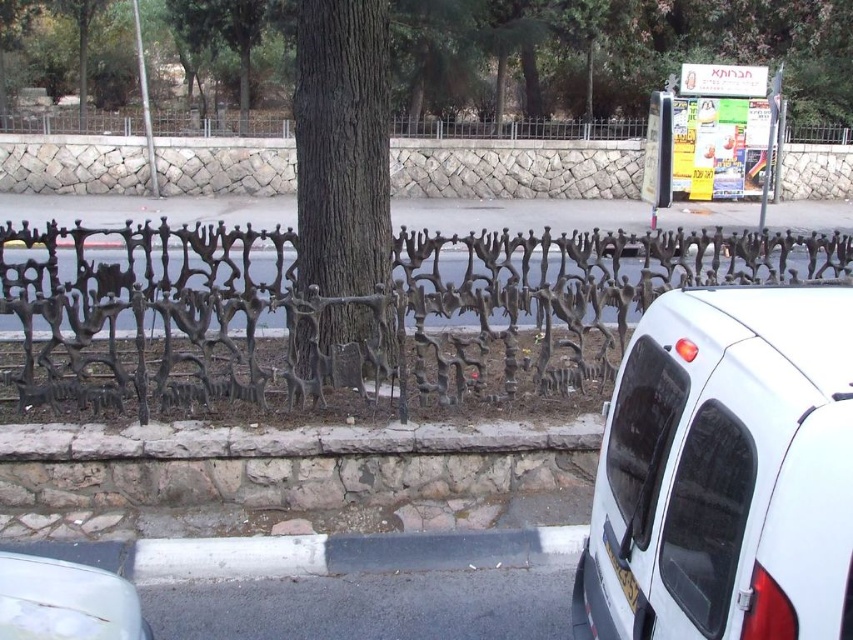
Which is more to the right, white matte minivan at right or brown rough bark tree at center?

Positioned to the right is white matte minivan at right.

Between white matte minivan at right and brown rough bark tree at center, which one is positioned higher?

brown rough bark tree at center is above.

Between point (682, 481) and point (322, 182), which one is positioned behind?

The point (322, 182) is more distant.

Where is `white matte minivan at right`? Image resolution: width=853 pixels, height=640 pixels. white matte minivan at right is located at coordinates (724, 472).

Consider the image. Does brown textured tree at center have a lesser height compared to white glossy car at lower left?

Incorrect, brown textured tree at center's height does not fall short of white glossy car at lower left's.

Does brown textured tree at center appear on the left side of white glossy car at lower left?

Indeed, brown textured tree at center is positioned on the left side of white glossy car at lower left.

Measure the distance between brown textured tree at center and camera.

brown textured tree at center is 12.49 meters away from camera.

Find the location of a particular element. The height and width of the screenshot is (640, 853). brown textured tree at center is located at coordinates (608, 52).

Does point (621, 518) come closer to viewer compared to point (36, 602)?

No, (621, 518) is behind (36, 602).

Is white matte minivan at right bigger than white glossy car at lower left?

Correct, white matte minivan at right is larger in size than white glossy car at lower left.

Locate an element on the screen. This screenshot has height=640, width=853. white matte minivan at right is located at coordinates (724, 472).